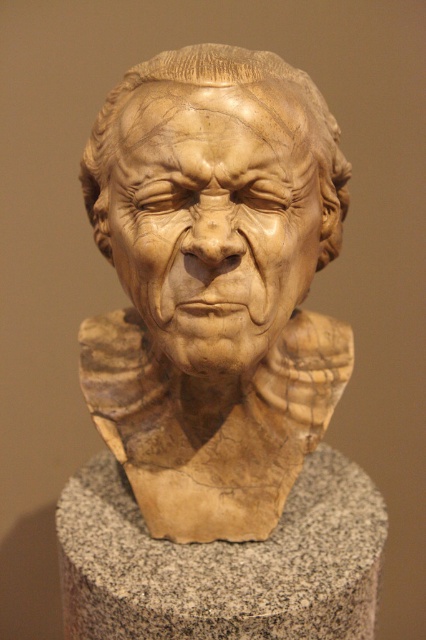
Question: Does marble bust at center have a smaller size compared to granite pedestal at center?

Choices:
 (A) no
 (B) yes

Answer: (A)

Question: Among these points, which one is farthest from the camera?

Choices:
 (A) (178, 100)
 (B) (144, 428)

Answer: (B)

Question: Estimate the real-world distances between objects in this image. Which object is farther from the light brown wood carving at center?

Choices:
 (A) marble bust at center
 (B) granite pedestal at center

Answer: (B)

Question: Is marble bust at center below granite pedestal at center?

Choices:
 (A) yes
 (B) no

Answer: (B)

Question: Considering the relative positions of light brown wood carving at center and granite pedestal at center in the image provided, where is light brown wood carving at center located with respect to granite pedestal at center?

Choices:
 (A) right
 (B) left

Answer: (B)

Question: Which of the following is the closest to the observer?

Choices:
 (A) granite pedestal at center
 (B) light brown wood carving at center

Answer: (B)